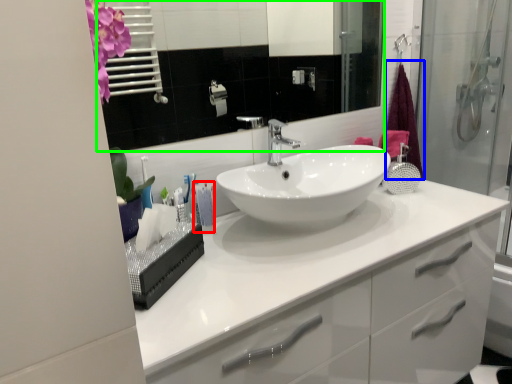
Question: Considering the real-world distances, which object is closest to toothpaste (highlighted by a red box)? shower curtain (highlighted by a blue box) or mirror (highlighted by a green box).

Choices:
 (A) shower curtain
 (B) mirror

Answer: (A)